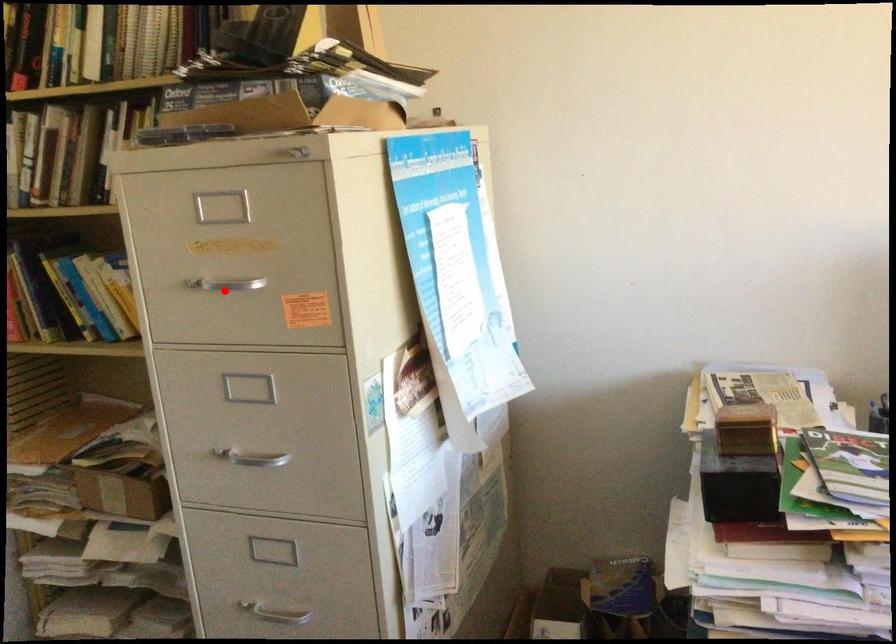
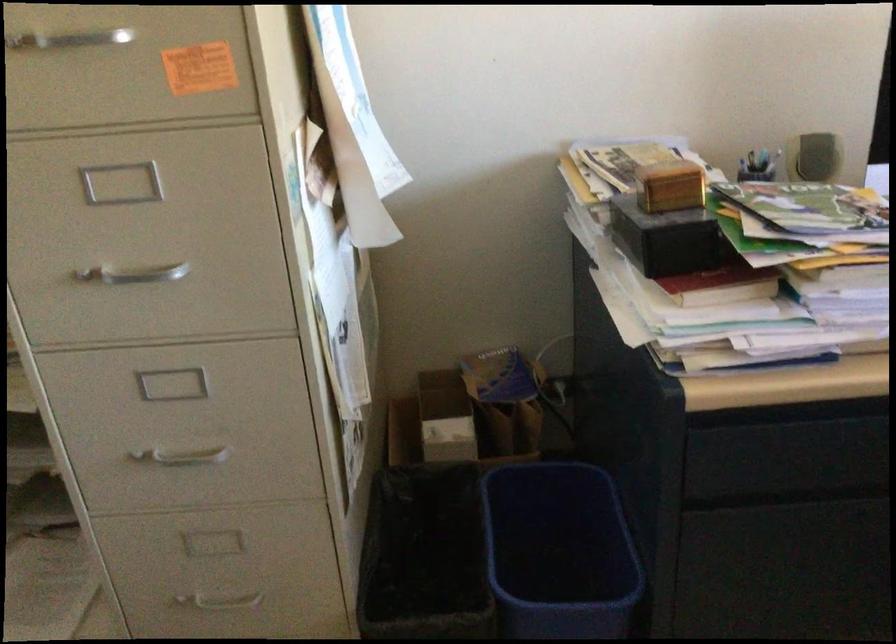
Where in the second image is the point corresponding to the highlighted location from the first image?

(67, 40)